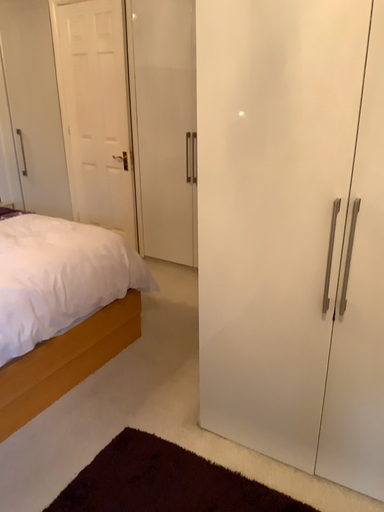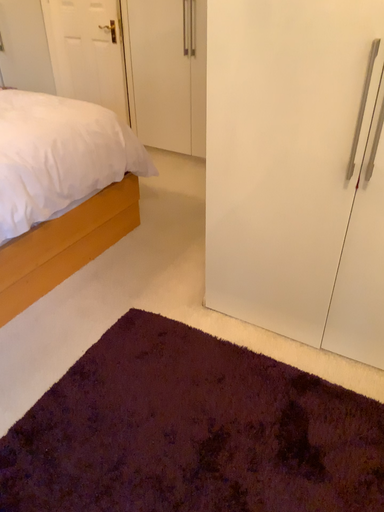
Question: Which way did the camera rotate in the video?

Choices:
 (A) rotated downward
 (B) rotated upward

Answer: (A)